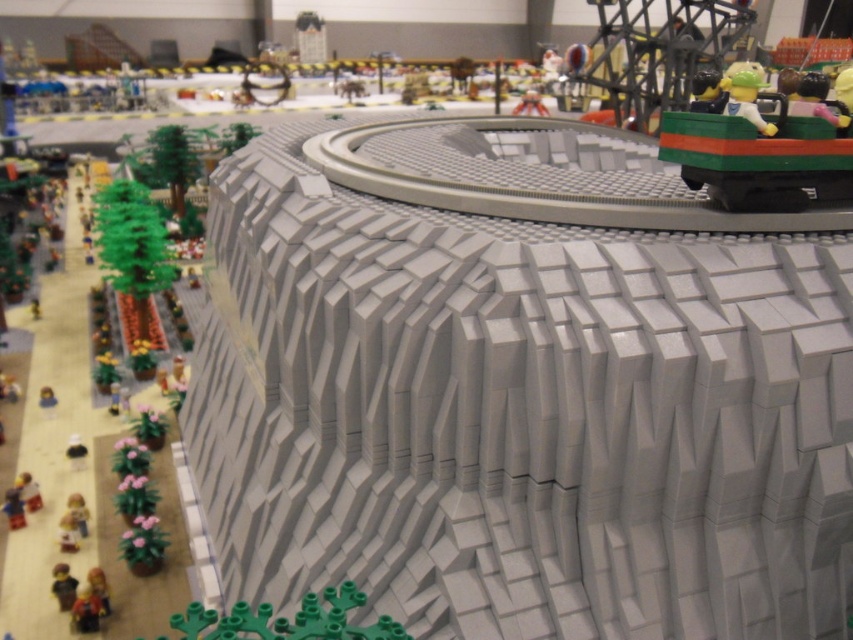
Question: Is green matte figure at upper right above translucent plastic cup at upper center?

Choices:
 (A) yes
 (B) no

Answer: (B)

Question: Is green matte figure at upper right closer to camera compared to translucent plastic cup at upper center?

Choices:
 (A) yes
 (B) no

Answer: (A)

Question: Which is nearer to the green plastic car at upper right?

Choices:
 (A) green matte figure at upper right
 (B) translucent plastic cup at upper center

Answer: (A)

Question: Among these objects, which one is farthest from the camera?

Choices:
 (A) green matte figure at upper right
 (B) green plastic car at upper right
 (C) translucent plastic cup at upper center

Answer: (C)

Question: Estimate the real-world distances between objects in this image. Which object is farther from the translucent plastic cup at upper center?

Choices:
 (A) green matte figure at upper right
 (B) green plastic car at upper right

Answer: (A)

Question: Can you confirm if green matte figure at upper right is positioned to the right of translucent plastic cup at upper center?

Choices:
 (A) no
 (B) yes

Answer: (B)